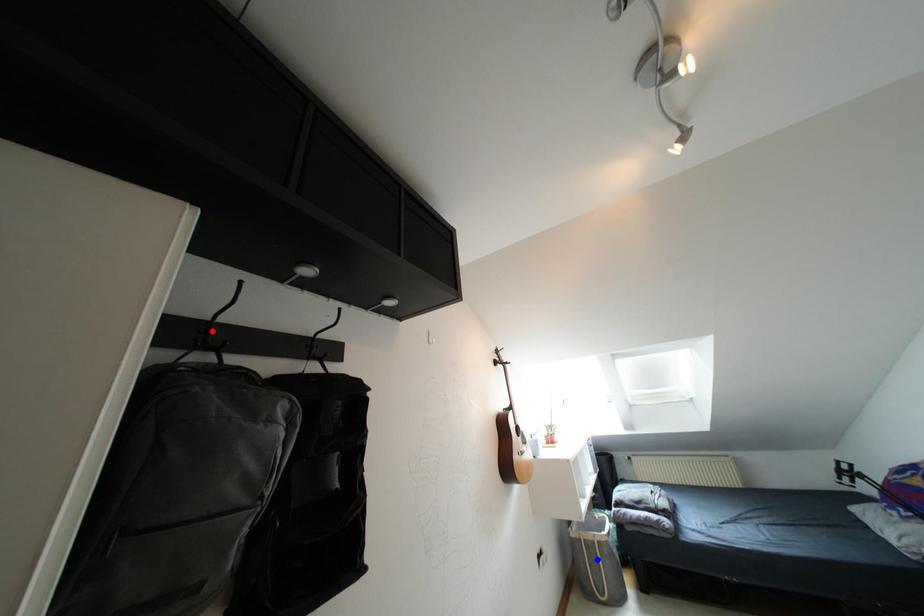
Question: Two points are marked on the image. Which point is closer to the camera?

Choices:
 (A) Blue point is closer.
 (B) Red point is closer.

Answer: (B)